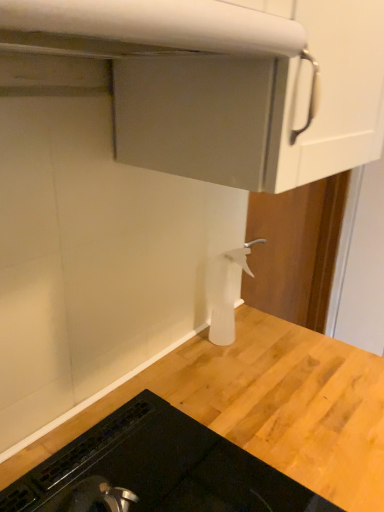
The width and height of the screenshot is (384, 512). Describe the element at coordinates (265, 406) in the screenshot. I see `black glass stovetop at lower left` at that location.

In order to click on white plastic spray bottle at center in this screenshot , I will do `click(225, 294)`.

Would you say white matte exhaust hood at upper center is outside white plastic spray bottle at center?

Yes.

Does white matte exhaust hood at upper center lie behind white plastic spray bottle at center?

No, it is in front of white plastic spray bottle at center.

From the image's perspective, which object appears higher, white plastic spray bottle at center or black glass stovetop at lower left?

From the image's view, white plastic spray bottle at center is above.

Looking at the image, does white plastic spray bottle at center seem bigger or smaller compared to black glass stovetop at lower left?

In the image, white plastic spray bottle at center appears to be smaller than black glass stovetop at lower left.

Is white plastic spray bottle at center in contact with black glass stovetop at lower left?

There is a gap between white plastic spray bottle at center and black glass stovetop at lower left.

From the picture: Is white plastic spray bottle at center turned away from black glass stovetop at lower left?

That's not correct — white plastic spray bottle at center is not looking away from black glass stovetop at lower left.

Considering the sizes of objects black glass stovetop at lower left and white matte exhaust hood at upper center in the image provided, who is shorter, black glass stovetop at lower left or white matte exhaust hood at upper center?

white matte exhaust hood at upper center.

Is black glass stovetop at lower left spatially inside white matte exhaust hood at upper center, or outside of it?

black glass stovetop at lower left is outside white matte exhaust hood at upper center.

Which object is closer to the camera taking this photo, black glass stovetop at lower left or white matte exhaust hood at upper center?

→ white matte exhaust hood at upper center.

Measure the distance from black glass stovetop at lower left to white matte exhaust hood at upper center.

black glass stovetop at lower left and white matte exhaust hood at upper center are 27.11 inches apart from each other.

Is white matte exhaust hood at upper center at the left side of black glass stovetop at lower left?

Correct, you'll find white matte exhaust hood at upper center to the left of black glass stovetop at lower left.

Based on their sizes in the image, would you say white matte exhaust hood at upper center is bigger or smaller than black glass stovetop at lower left?

white matte exhaust hood at upper center is smaller than black glass stovetop at lower left.

Which of these two, white matte exhaust hood at upper center or black glass stovetop at lower left, is thinner?

white matte exhaust hood at upper center.

From the image's perspective, is white matte exhaust hood at upper center positioned above or below black glass stovetop at lower left?

From the image's perspective, white matte exhaust hood at upper center appears above black glass stovetop at lower left.

Consider the image. In terms of height, does black glass stovetop at lower left look taller or shorter compared to white plastic spray bottle at center?

In the image, black glass stovetop at lower left appears to be shorter than white plastic spray bottle at center.

Is black glass stovetop at lower left wider than white plastic spray bottle at center?

Yes, black glass stovetop at lower left is wider than white plastic spray bottle at center.

Would you say black glass stovetop at lower left is inside or outside white plastic spray bottle at center?

black glass stovetop at lower left exists outside the volume of white plastic spray bottle at center.

From a real-world perspective, is white plastic spray bottle at center on top of white matte exhaust hood at upper center?

No.

Is there a large distance between white plastic spray bottle at center and white matte exhaust hood at upper center?

They are positioned close to each other.

Is white plastic spray bottle at center wider than white matte exhaust hood at upper center?

No, white plastic spray bottle at center is not wider than white matte exhaust hood at upper center.

The height and width of the screenshot is (512, 384). In order to click on exhaust hood above the white plastic spray bottle at center (from the image's perspective) in this screenshot , I will do `click(148, 27)`.

This screenshot has height=512, width=384. What are the coordinates of `countertop in front of the white plastic spray bottle at center` in the screenshot? It's located at (265, 406).

Which object lies nearer to the anchor point black glass stovetop at lower left, white matte exhaust hood at upper center or white plastic spray bottle at center?

white plastic spray bottle at center is positioned closer to the anchor black glass stovetop at lower left.

Looking at the image, which one is located further to white matte exhaust hood at upper center, black glass stovetop at lower left or white plastic spray bottle at center?

black glass stovetop at lower left is positioned further to the anchor white matte exhaust hood at upper center.

Which object lies further to the anchor point black glass stovetop at lower left, white plastic spray bottle at center or white matte exhaust hood at upper center?

white matte exhaust hood at upper center.

Considering their positions, is white matte exhaust hood at upper center positioned closer to white plastic spray bottle at center than black glass stovetop at lower left?

black glass stovetop at lower left lies closer to white plastic spray bottle at center than the other object.

Considering their positions, is black glass stovetop at lower left positioned closer to white plastic spray bottle at center than white matte exhaust hood at upper center?

Among the two, black glass stovetop at lower left is located nearer to white plastic spray bottle at center.

Which object lies further to the anchor point white matte exhaust hood at upper center, white plastic spray bottle at center or black glass stovetop at lower left?

black glass stovetop at lower left lies further to white matte exhaust hood at upper center than the other object.

Locate an element on the screen. countertop positioned between white matte exhaust hood at upper center and white plastic spray bottle at center from near to far is located at coordinates (265, 406).